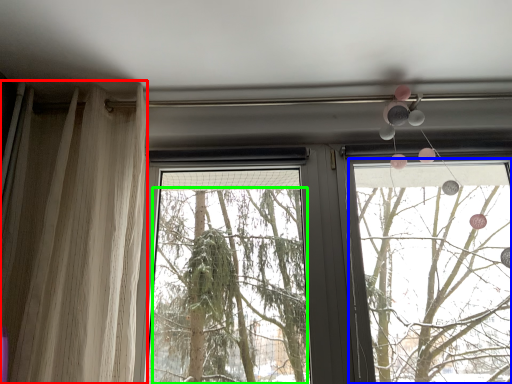
Question: Which object is the closest to the curtain (highlighted by a red box)? Choose among these: window frame (highlighted by a blue box) or tree (highlighted by a green box).

Choices:
 (A) window frame
 (B) tree

Answer: (B)